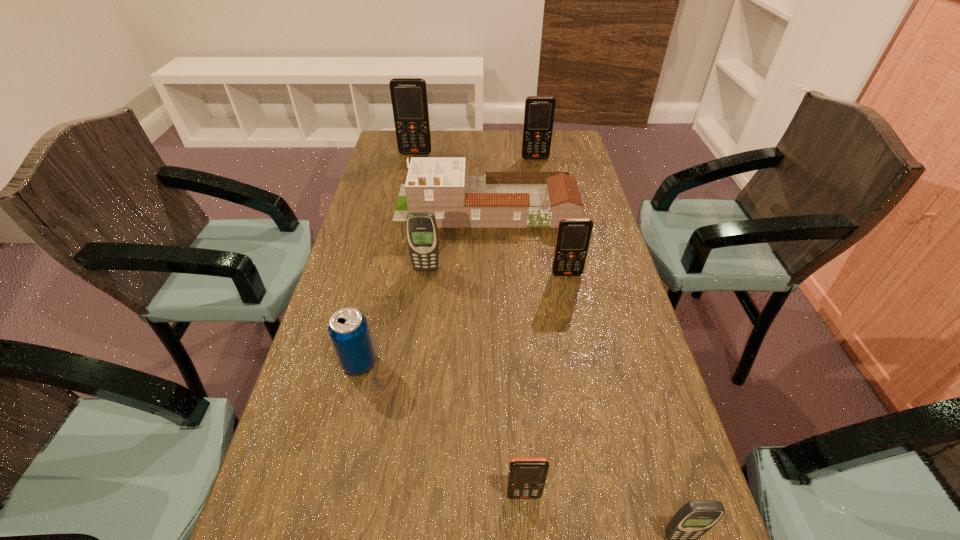
At what (x,y) coordinates should I click in order to perform the action: click on free space between the nearest orange cellular telephone and the second nearest orange cellular telephone. Please return your answer as a coordinate pair (x, y). Looking at the image, I should click on (545, 384).

This screenshot has width=960, height=540. I want to click on vacant space in between the third nearest object and the fifth nearest cellular telephone, so click(x=447, y=260).

Locate an element on the screen. This screenshot has height=540, width=960. empty space between the third biggest orange cellular telephone and the dollhouse is located at coordinates (526, 240).

The width and height of the screenshot is (960, 540). Find the location of `empty location between the second nearest object and the red dollhouse`. empty location between the second nearest object and the red dollhouse is located at coordinates (504, 350).

The height and width of the screenshot is (540, 960). I want to click on the seventh closest object relative to the nearest orange cellular telephone, so click(409, 99).

You are a GUI agent. You are given a task and a screenshot of the screen. Output one action in this format:
    pyautogui.click(x=<x>, y=<y>)
    Task: Click on the object that is the closest to the third farthest object
    The height and width of the screenshot is (540, 960).
    Given the screenshot: What is the action you would take?
    pyautogui.click(x=421, y=229)

Identify the location of the fourth closest cellular telephone to the second tallest object. This screenshot has height=540, width=960. (x=527, y=475).

Identify which cellular telephone is the third nearest to the third farthest orange cellular telephone. Please provide its 2D coordinates. Your answer should be formatted as a tuple, i.e. [(x, y)], where the tuple contains the x and y coordinates of a point satisfying the conditions above.

[(539, 112)]

Where is `orange cellular telephone identified as the fourth closest to the blue pop soda`? The width and height of the screenshot is (960, 540). orange cellular telephone identified as the fourth closest to the blue pop soda is located at coordinates (539, 112).

Identify the location of orange cellular telephone that can be found as the third closest to the second orange cellular telephone from left to right. (409, 99).